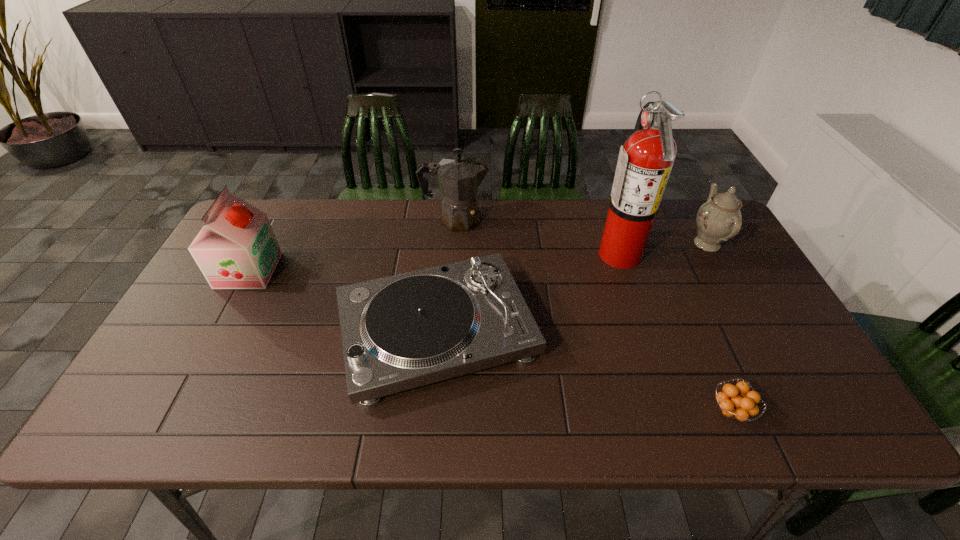
Where is `coffeepot positioned at the far edge`? coffeepot positioned at the far edge is located at coordinates (459, 177).

The width and height of the screenshot is (960, 540). What are the coordinates of `chinaware that is at the far edge` in the screenshot? It's located at (719, 219).

Where is `record player that is at the near edge`? record player that is at the near edge is located at coordinates (403, 331).

Where is `orange fruit present at the near edge`? This screenshot has width=960, height=540. orange fruit present at the near edge is located at coordinates (734, 402).

Where is `object that is at the left edge`? The height and width of the screenshot is (540, 960). object that is at the left edge is located at coordinates (236, 249).

At what (x,y) coordinates should I click in order to perform the action: click on object present at the right edge. Please return your answer as a coordinate pair (x, y). This screenshot has width=960, height=540. Looking at the image, I should click on (719, 219).

Identify the location of object that is positioned at the far right corner. The image size is (960, 540). (719, 219).

This screenshot has height=540, width=960. In the image, there is a desktop. Identify the location of vacant space at the far edge. (374, 238).

The image size is (960, 540). In order to click on free space at the near edge of the desktop in this screenshot , I will do `click(680, 401)`.

This screenshot has height=540, width=960. What are the coordinates of `free location at the left edge of the desktop` in the screenshot? It's located at (253, 289).